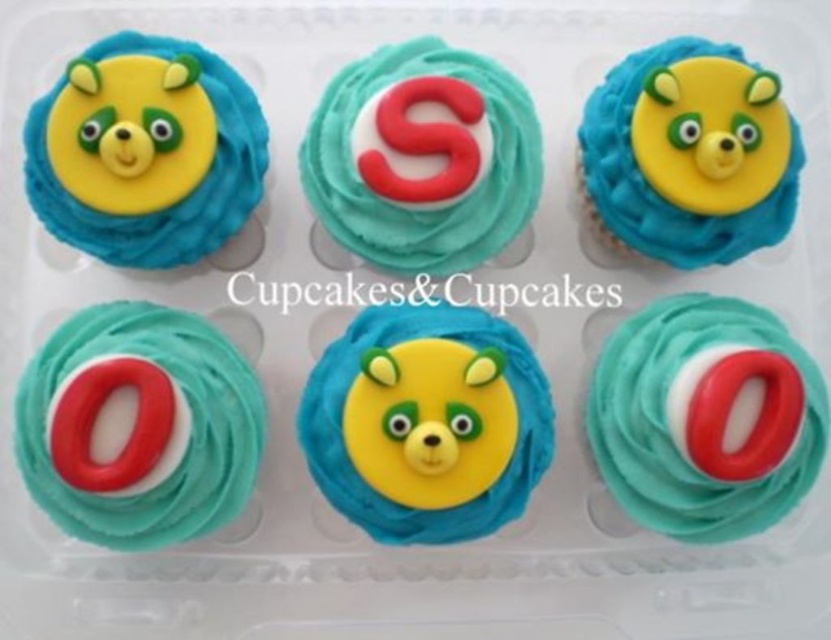
Who is positioned more to the right, teal matte frosting at bottom right or matte yellow bear at upper left?

teal matte frosting at bottom right is more to the right.

Does point (655, 317) lie behind point (247, 109)?

No, (655, 317) is closer to viewer.

Find the location of `teal matte frosting at bottom right`. teal matte frosting at bottom right is located at coordinates (706, 417).

Which is below, matte yellow bear at upper left or teal matte frosting at center?

matte yellow bear at upper left

Is matte yellow bear at upper left wider than teal matte frosting at center?

No.

Is point (129, 129) more distant than point (475, 109)?

No.

This screenshot has height=640, width=831. I want to click on matte yellow bear at upper left, so click(145, 150).

Is teal matte icing at center left bigger than matte yellow bear at upper right?

Yes, teal matte icing at center left is bigger than matte yellow bear at upper right.

What do you see at coordinates (138, 426) in the screenshot? Image resolution: width=831 pixels, height=640 pixels. I see `teal matte icing at center left` at bounding box center [138, 426].

Who is more distant from viewer, (119, 305) or (731, 52)?

The point (731, 52) is more distant.

Identify the location of teal matte icing at center left. The width and height of the screenshot is (831, 640). (138, 426).